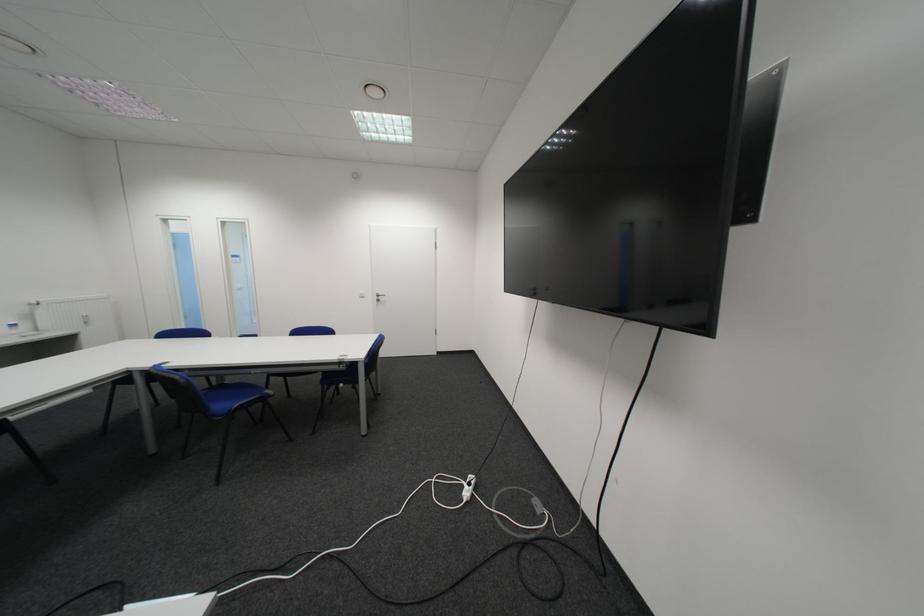
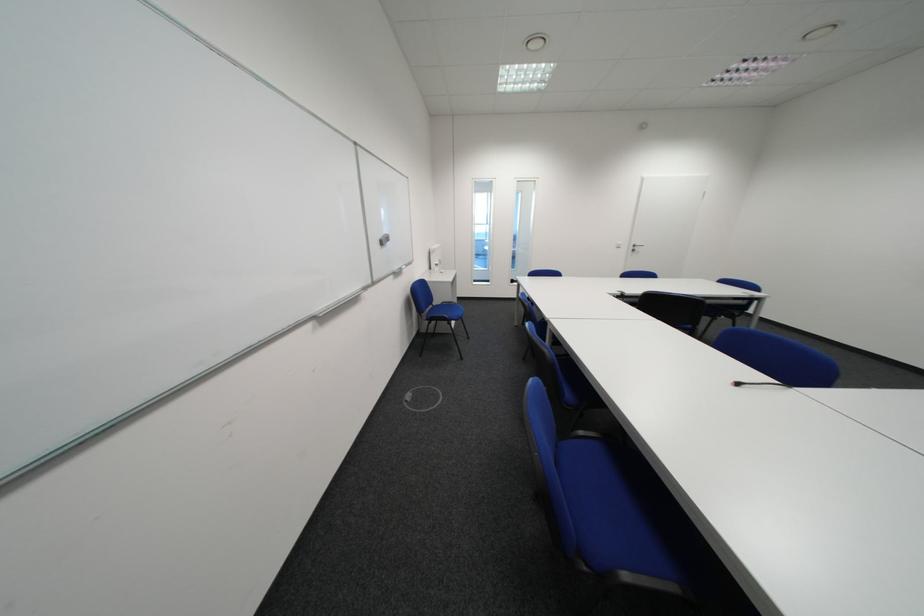
In the second image, find the point that corresponds to (372,299) in the first image.

(628, 249)